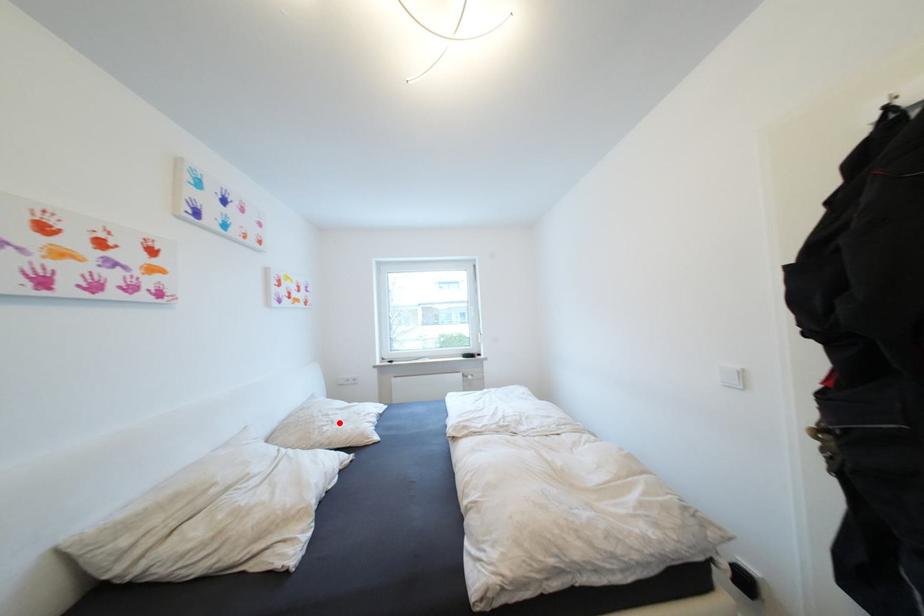
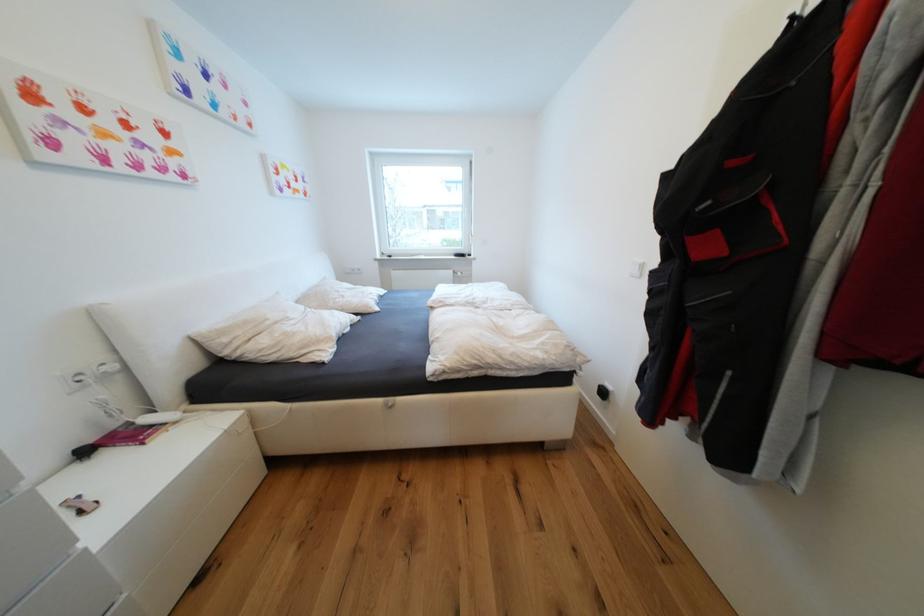
Where in the second image is the point corresponding to the highlighted location from the first image?

(349, 297)